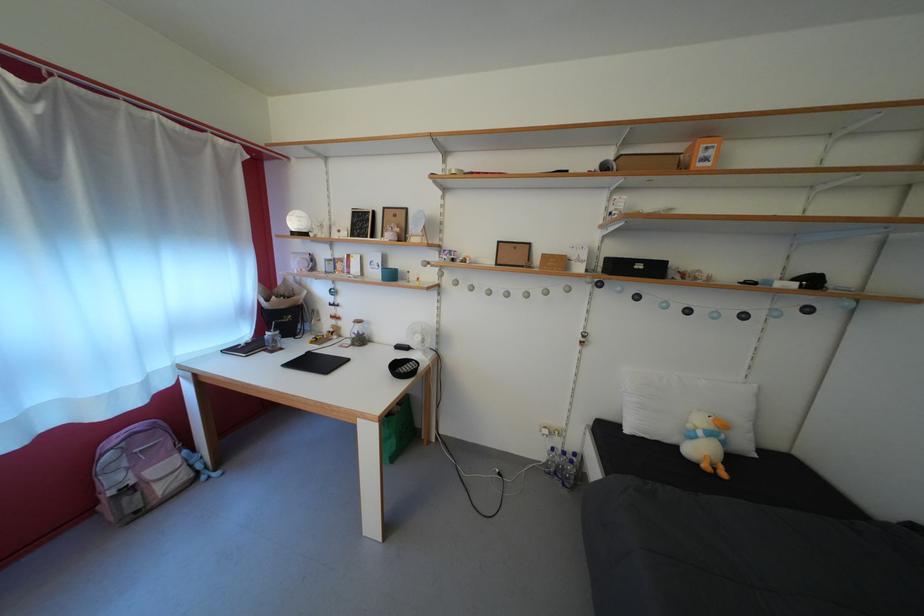
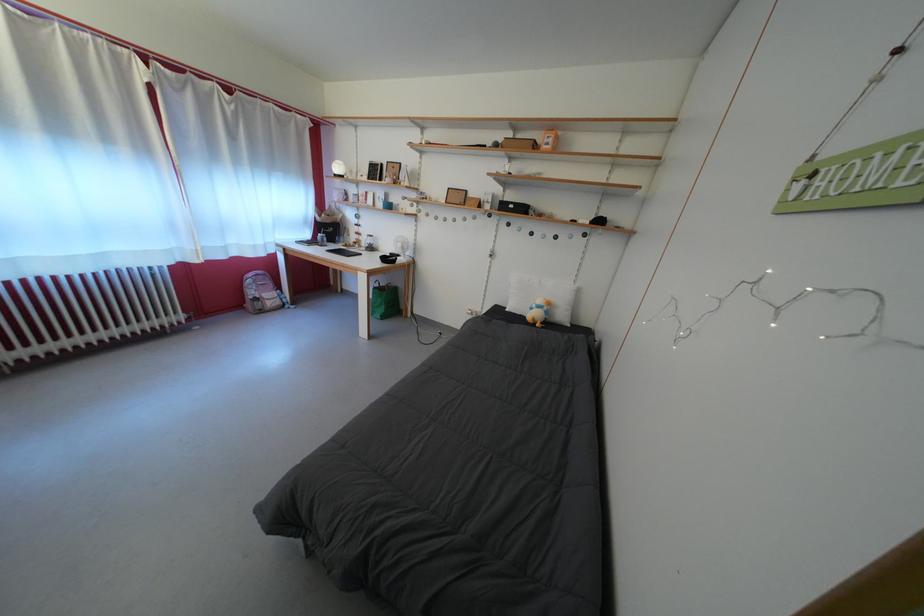
In the second image, find the point that corresponds to point 648,273 in the first image.

(519, 213)